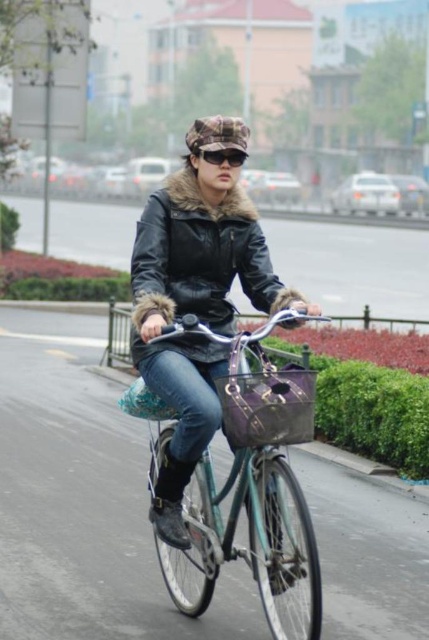
You are a delivery person who needs to check if your teal metallic bicycle at center can fit through a narrow alley that is only 1.5 meters tall. Given that the black matte sunglasses at center are 20 cm tall, can your bicycle pass through the alley?

The teal metallic bicycle at center is much taller than the black matte sunglasses at center, which are 20 cm tall. Since the alley is only 1.5 meters tall, the bicycle is likely taller than 20 cm and may not fit through the alley.

You are standing at point (218, 152) and want to walk to point (281, 579). Is the destination ahead of you?

Yes, point (281, 579) is in front of point (218, 152), so the destination is ahead.

You are a delivery person who needs to find the teal metallic bicycle at center. Based on the scene description, where should you look to locate it?

The teal metallic bicycle at center is located at the point with coordinates 0.748 on the x axis and 0.587 on the y axis.